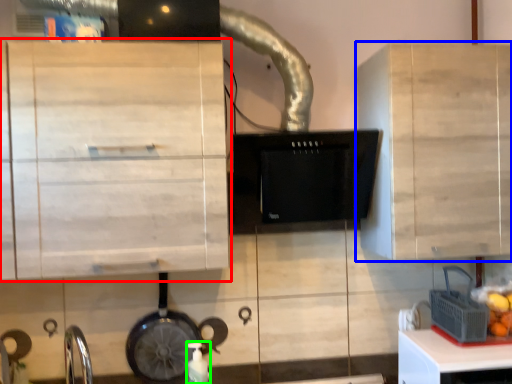
Question: Which is nearer to the cabinetry (highlighted by a red box)? cabinetry (highlighted by a blue box) or bottle (highlighted by a green box).

Choices:
 (A) cabinetry
 (B) bottle

Answer: (B)